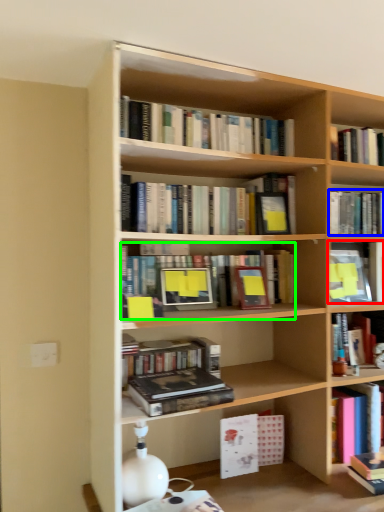
Question: Estimate the real-world distances between objects in this image. Which object is closer to book (highlighted by a red box), book (highlighted by a blue box) or book (highlighted by a green box)?

Choices:
 (A) book
 (B) book

Answer: (A)